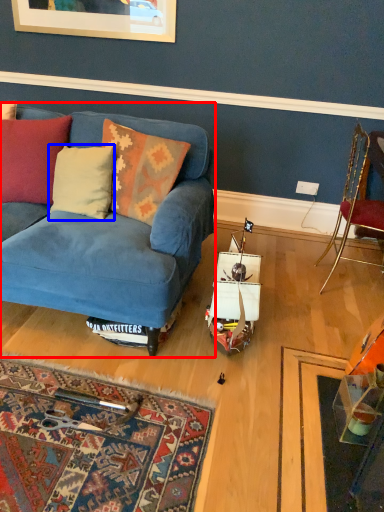
Question: Which object is closer to the camera taking this photo, studio couch (highlighted by a red box) or pillow (highlighted by a blue box)?

Choices:
 (A) studio couch
 (B) pillow

Answer: (A)